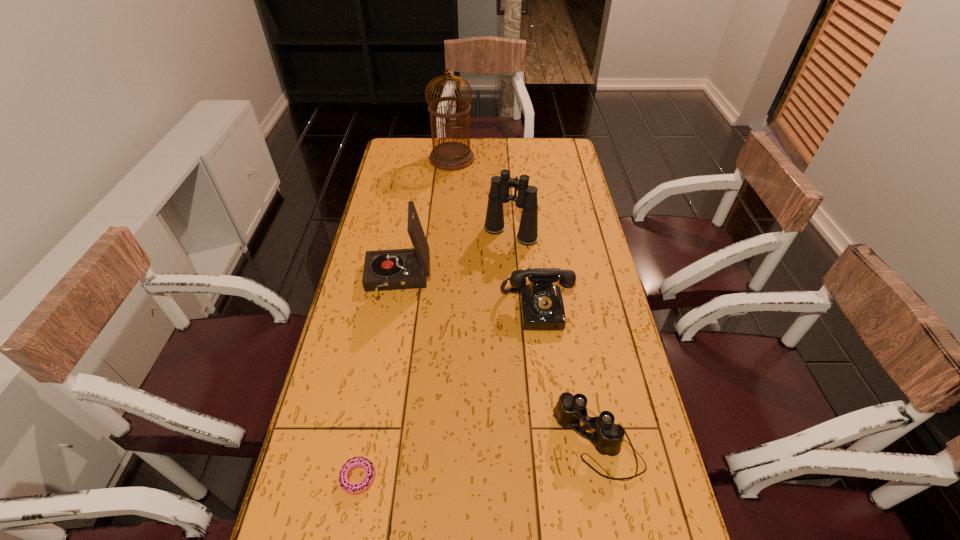
In the image, there is a desktop. Where is `vacant region at the far edge`? This screenshot has width=960, height=540. vacant region at the far edge is located at coordinates (492, 156).

The width and height of the screenshot is (960, 540). I want to click on free space at the left edge of the desktop, so click(x=405, y=228).

The height and width of the screenshot is (540, 960). Find the location of `vacant space at the right edge of the desktop`. vacant space at the right edge of the desktop is located at coordinates (618, 503).

Where is `free space at the far left corner`? The height and width of the screenshot is (540, 960). free space at the far left corner is located at coordinates (400, 157).

Identify the location of free space at the far right corner of the desktop. (550, 148).

Where is `empty space that is in between the farthest object and the shortest object`? The height and width of the screenshot is (540, 960). empty space that is in between the farthest object and the shortest object is located at coordinates coord(405,318).

The width and height of the screenshot is (960, 540). I want to click on vacant space in between the phonograph record and the farther binoculars, so click(454, 257).

Where is `free space between the farther binoculars and the shorter binoculars`? free space between the farther binoculars and the shorter binoculars is located at coordinates (554, 338).

Locate an element on the screen. free space between the second farthest object and the phonograph record is located at coordinates (454, 257).

Where is `free space that is in between the farthest object and the shortest object`? free space that is in between the farthest object and the shortest object is located at coordinates (405, 318).